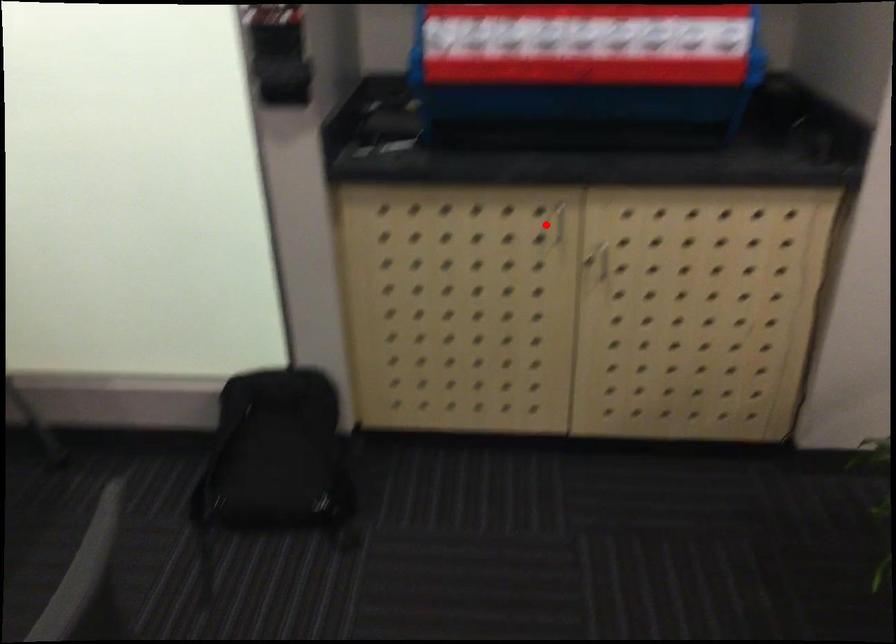
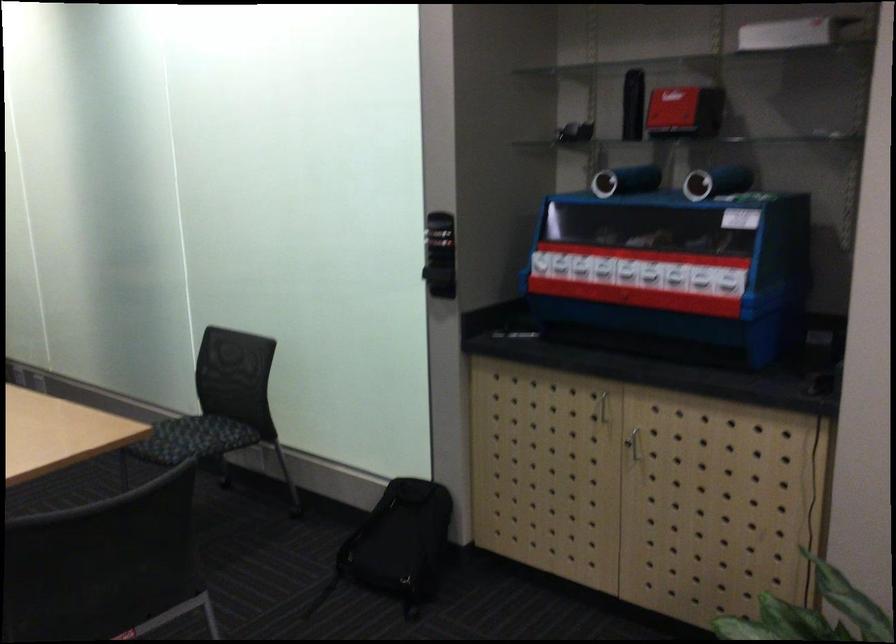
Question: I am providing you with two images of the same scene from different viewpoints. A red point is shown in image1. For the corresponding object point in image2, is it positioned nearer or farther from the camera?

Choices:
 (A) Nearer
 (B) Farther

Answer: (B)